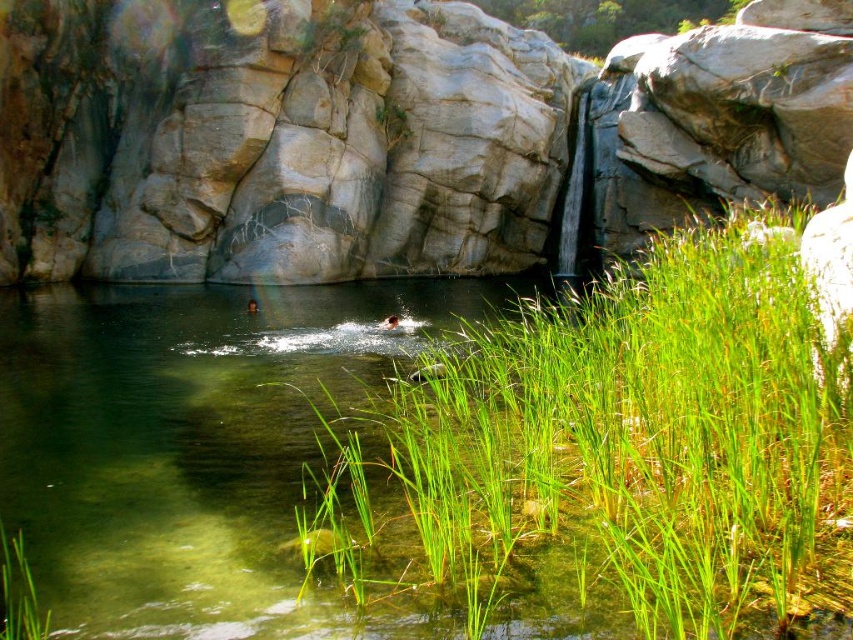
From the picture: Is gray/rough rock at center to the right of green grass at lower left from the viewer's perspective?

Correct, you'll find gray/rough rock at center to the right of green grass at lower left.

Does gray/rough rock at center appear on the left side of green grass at lower left?

No, gray/rough rock at center is not to the left of green grass at lower left.

The image size is (853, 640). Identify the location of gray/rough rock at center. (390, 134).

Between gray/rough rock at center and green grass at center, which one is positioned lower?

Positioned lower is green grass at center.

Does gray/rough rock at center have a lesser height compared to green grass at center?

No, gray/rough rock at center is not shorter than green grass at center.

In order to click on gray/rough rock at center in this screenshot , I will do `click(390, 134)`.

You are a GUI agent. You are given a task and a screenshot of the screen. Output one action in this format:
    pyautogui.click(x=<x>, y=<y>)
    Task: Click on the gray/rough rock at center
    
    Given the screenshot: What is the action you would take?
    pyautogui.click(x=390, y=134)

Describe the element at coordinates (610, 452) in the screenshot. I see `green grass at center` at that location.

Between point (607, 316) and point (30, 612), which one is positioned in front?

Positioned in front is point (30, 612).

The width and height of the screenshot is (853, 640). In order to click on green grass at center in this screenshot , I will do `click(610, 452)`.